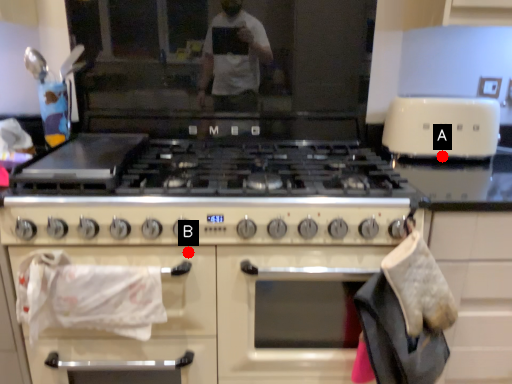
Question: Two points are circled on the image, labeled by A and B beside each circle. Among these points, which one is farthest from the camera?

Choices:
 (A) A is further
 (B) B is further

Answer: (A)